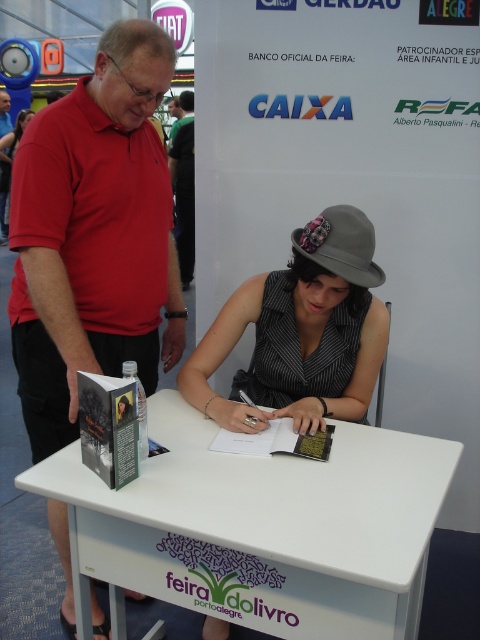
Question: Which object is positioned farthest from the matte red shirt at left?

Choices:
 (A) white plastic table at center
 (B) matte black dress at center

Answer: (A)

Question: Which point is farther to the camera?

Choices:
 (A) (72, 221)
 (B) (400, 625)
 (C) (16, 124)

Answer: (C)

Question: Which object is farther from the camera taking this photo?

Choices:
 (A) gray felt hat at center
 (B) white plastic table at center
 (C) matte black dress at center
 (D) matte red shirt at left

Answer: (C)

Question: Is gray felt hat at center to the right of matte black dress at center from the viewer's perspective?

Choices:
 (A) yes
 (B) no

Answer: (A)

Question: Is gray felt hat at center to the left of matte red shirt at left from the viewer's perspective?

Choices:
 (A) yes
 (B) no

Answer: (B)

Question: Can you confirm if white plastic table at center is smaller than matte red shirt at left?

Choices:
 (A) no
 (B) yes

Answer: (B)